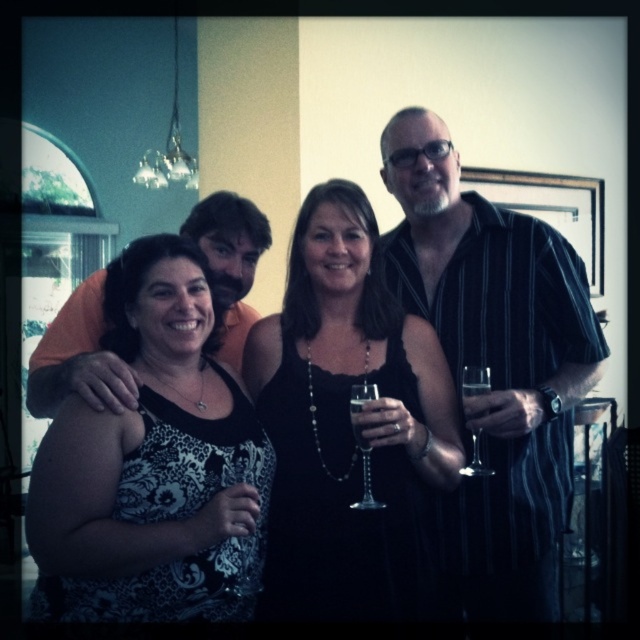
Question: Estimate the real-world distances between objects in this image. Which object is farther from the black satin dress at center?

Choices:
 (A) clear glass wine at right
 (B) black wood picture frame at upper right

Answer: (B)

Question: Based on their relative distances, which object is farther from the clear glass wine at center?

Choices:
 (A) orangematerialshirt at left
 (B) black wood picture frame at upper right
 (C) clear glass wine glass at center
 (D) black lace dress at left

Answer: (B)

Question: Which object is positioned closest to the black satin dress at center?

Choices:
 (A) orangematerialshirt at left
 (B) clear glass wine at center

Answer: (B)

Question: Considering the relative positions of black lace dress at left and clear glass wine glass at center in the image provided, where is black lace dress at left located with respect to clear glass wine glass at center?

Choices:
 (A) above
 (B) below

Answer: (A)

Question: Is black wood picture frame at upper right wider than clear glass wine glass at right?

Choices:
 (A) yes
 (B) no

Answer: (A)

Question: Is black wood picture frame at upper right positioned before clear glass wine glass at right?

Choices:
 (A) no
 (B) yes

Answer: (A)